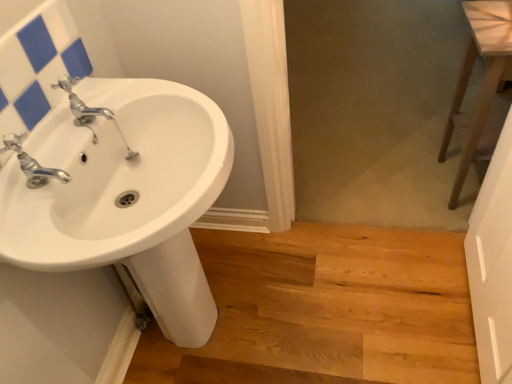
Find the location of a particular element. The height and width of the screenshot is (384, 512). spots to the right of white glossy sink at left is located at coordinates (327, 311).